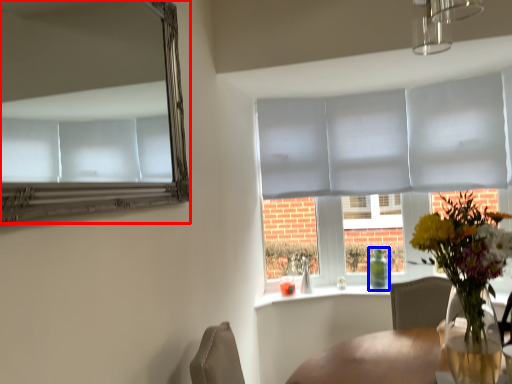
Question: Which object appears farthest to the camera in this image, mirror (highlighted by a red box) or bottle (highlighted by a blue box)?

Choices:
 (A) mirror
 (B) bottle

Answer: (B)